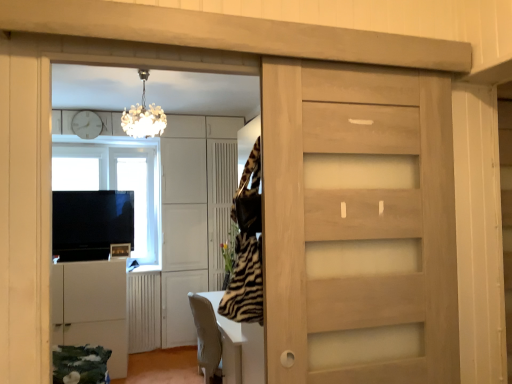
Question: Is flat screen tv at left, which is counted as the 1th appliance, starting from the top, at the right side of matte white cabinet at left?

Choices:
 (A) no
 (B) yes

Answer: (A)

Question: Could you tell me if flat screen tv at left, the second appliance positioned from the bottom, is facing matte white cabinet at left?

Choices:
 (A) yes
 (B) no

Answer: (A)

Question: Is flat screen tv at left, which is counted as the 1th appliance, starting from the top, at the left side of matte white cabinet at left?

Choices:
 (A) no
 (B) yes

Answer: (B)

Question: Is flat screen tv at left, the second appliance positioned from the bottom, positioned before matte white cabinet at left?

Choices:
 (A) yes
 (B) no

Answer: (B)

Question: From a real-world perspective, is flat screen tv at left, which is counted as the 1th appliance, starting from the top, under matte white cabinet at left?

Choices:
 (A) yes
 (B) no

Answer: (A)

Question: Does flat screen tv at left, which is counted as the 1th appliance, starting from the top, have a greater height compared to matte white cabinet at left?

Choices:
 (A) yes
 (B) no

Answer: (B)

Question: Is metallic silver toaster at lower left, marked as the first appliance in a bottom-to-top arrangement, wider than transparent glass window at upper left?

Choices:
 (A) no
 (B) yes

Answer: (A)

Question: Is metallic silver toaster at lower left, marked as the first appliance in a bottom-to-top arrangement, facing towards transparent glass window at upper left?

Choices:
 (A) no
 (B) yes

Answer: (A)

Question: Is metallic silver toaster at lower left, marked as the first appliance in a bottom-to-top arrangement, not inside transparent glass window at upper left?

Choices:
 (A) no
 (B) yes

Answer: (B)

Question: Considering the relative sizes of metallic silver toaster at lower left, marked as the 2th appliance in a top-to-bottom arrangement, and transparent glass window at upper left in the image provided, is metallic silver toaster at lower left, marked as the 2th appliance in a top-to-bottom arrangement, taller than transparent glass window at upper left?

Choices:
 (A) yes
 (B) no

Answer: (B)

Question: Is metallic silver toaster at lower left, marked as the 2th appliance in a top-to-bottom arrangement, not near transparent glass window at upper left?

Choices:
 (A) no
 (B) yes

Answer: (B)

Question: From a real-world perspective, is metallic silver toaster at lower left, marked as the first appliance in a bottom-to-top arrangement, under transparent glass window at upper left?

Choices:
 (A) yes
 (B) no

Answer: (A)

Question: Is the position of matte white cabinet at left less distant than that of transparent glass window at upper left?

Choices:
 (A) no
 (B) yes

Answer: (B)